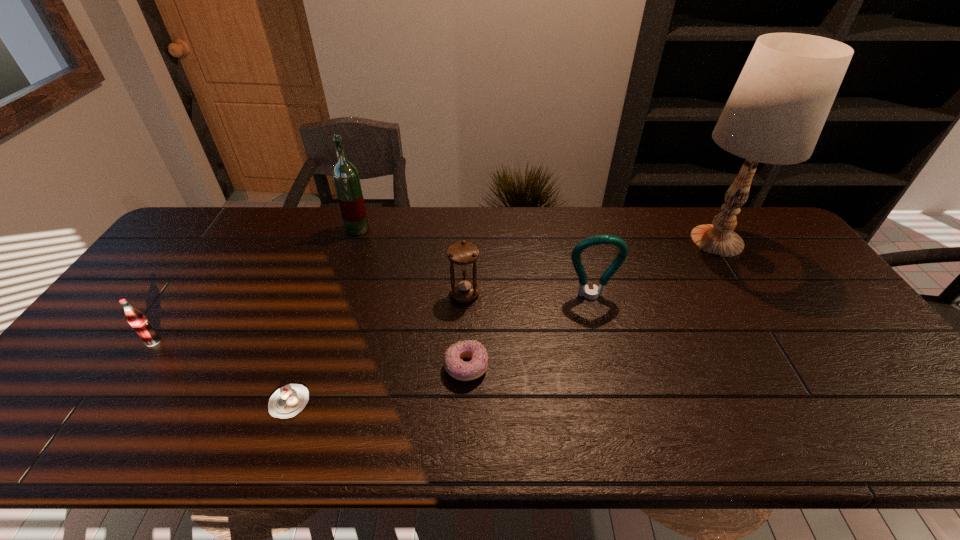
This screenshot has height=540, width=960. I want to click on vacant point located between the leftmost object and the hourglass, so click(x=309, y=318).

Find the location of a particular element. Image resolution: width=960 pixels, height=540 pixels. vacant space that's between the hourglass and the shortest object is located at coordinates (377, 348).

Identify the location of free spot between the hourglass and the rightmost object. (590, 267).

Identify the location of unoccupied area between the hourglass and the rightmost object. The image size is (960, 540). (590, 267).

Find the location of a particular element. This screenshot has height=540, width=960. vacant area between the hourglass and the second shortest object is located at coordinates (466, 330).

At what (x,y) coordinates should I click in order to perform the action: click on free space between the cupcake and the hourglass. Please return your answer as a coordinate pair (x, y). This screenshot has height=540, width=960. Looking at the image, I should click on (377, 348).

You are a GUI agent. You are given a task and a screenshot of the screen. Output one action in this format:
    pyautogui.click(x=<x>, y=<y>)
    Task: Click on the free space between the hourglass and the liquor
    The image size is (960, 540).
    Given the screenshot: What is the action you would take?
    pyautogui.click(x=411, y=261)

You are a GUI agent. You are given a task and a screenshot of the screen. Output one action in this format:
    pyautogui.click(x=<x>, y=<y>)
    Task: Click on the free space that is in between the sixth shortest object and the leftmost object
    
    Given the screenshot: What is the action you would take?
    pyautogui.click(x=255, y=285)

Locate which object ranks third in proximity to the lamp. Please provide its 2D coordinates. Your answer should be formatted as a tuple, i.e. [(x, y)], where the tuple contains the x and y coordinates of a point satisfying the conditions above.

[(454, 365)]

Find the location of a particular element. object that is the fourth closest to the leftmost object is located at coordinates (462, 254).